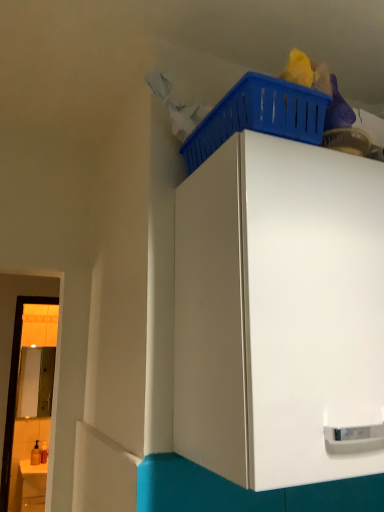
Question: In the image, is white glossy cabinet at upper center on the left side or the right side of matte white counter at lower left?

Choices:
 (A) right
 (B) left

Answer: (A)

Question: In terms of size, does white glossy cabinet at upper center appear bigger or smaller than matte white counter at lower left?

Choices:
 (A) big
 (B) small

Answer: (A)

Question: Which object is the closest to the matte white counter at lower left?

Choices:
 (A) white glossy cabinet at upper center
 (B) blue plastic basket at upper right

Answer: (A)

Question: Which of these objects is positioned closest to the blue plastic basket at upper right?

Choices:
 (A) matte white counter at lower left
 (B) white glossy cabinet at upper center

Answer: (B)